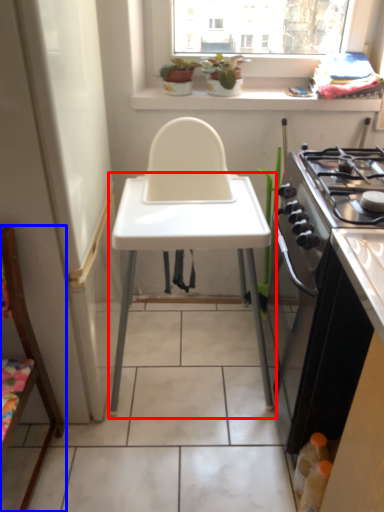
Question: Which point is closer to the camera, changing table (highlighted by a red box) or chair (highlighted by a blue box)?

Choices:
 (A) changing table
 (B) chair

Answer: (B)